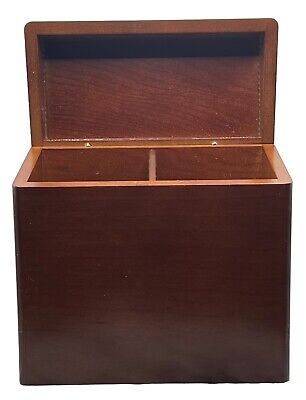
At what (x,y) coordinates should I click in order to perform the action: click on box divider. Please return your answer as a coordinate pair (x, y). Looking at the image, I should click on (150, 166).